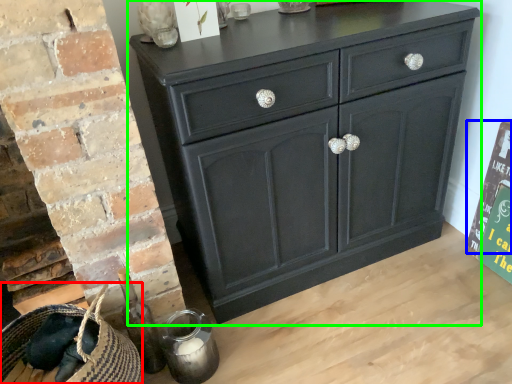
Question: Which is farther away from basket (highlighted by a red box)? bulletin board (highlighted by a blue box) or chest of drawers (highlighted by a green box)?

Choices:
 (A) bulletin board
 (B) chest of drawers

Answer: (A)